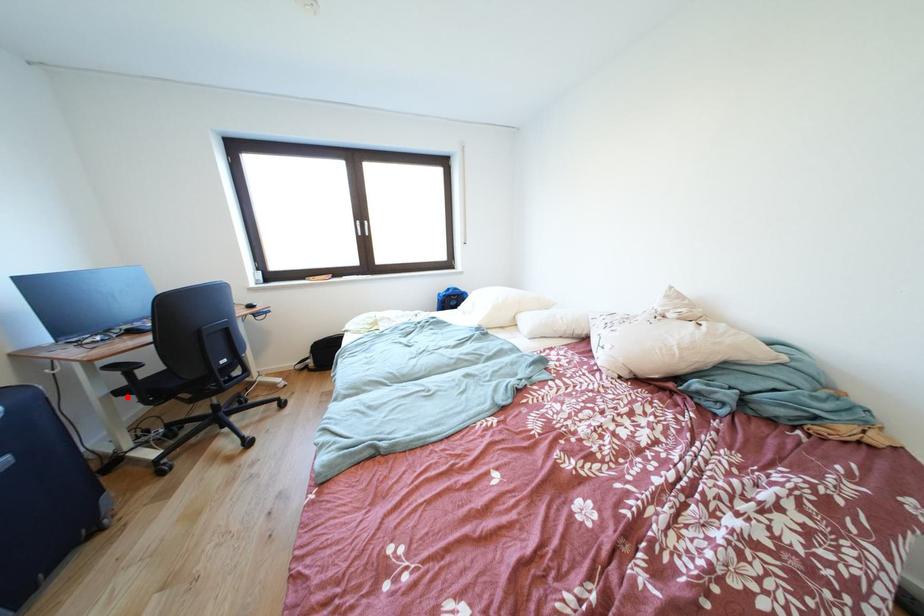
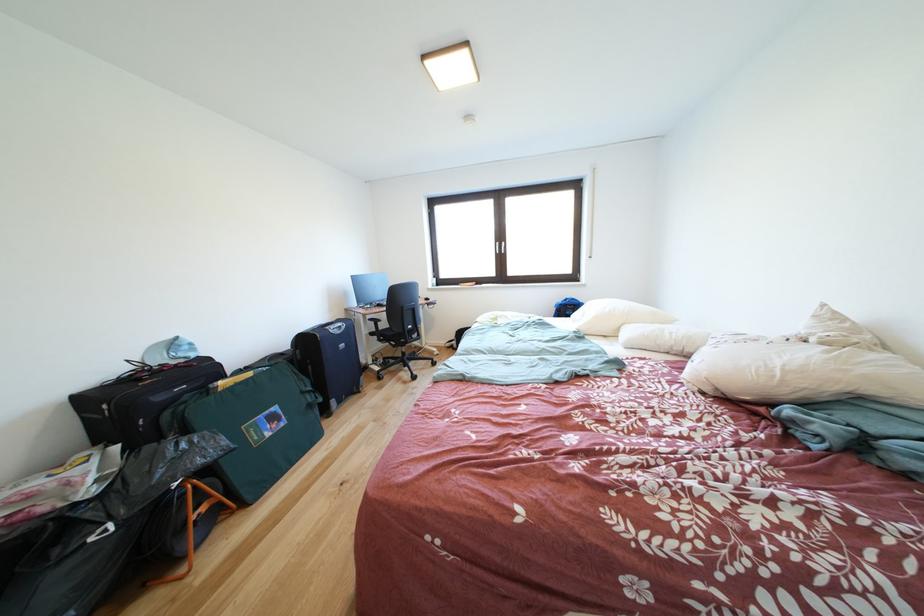
Question: I am providing you with two images of the same scene from different viewpoints. Given a red point in image1, look at the same physical point in image2. Is it:

Choices:
 (A) Closer to the viewpoint
 (B) Farther from the viewpoint

Answer: (B)